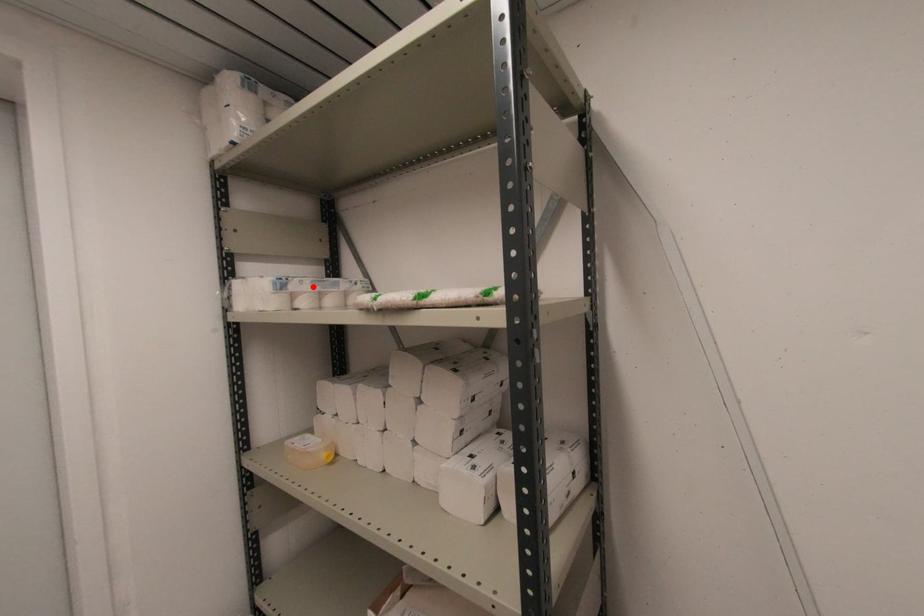
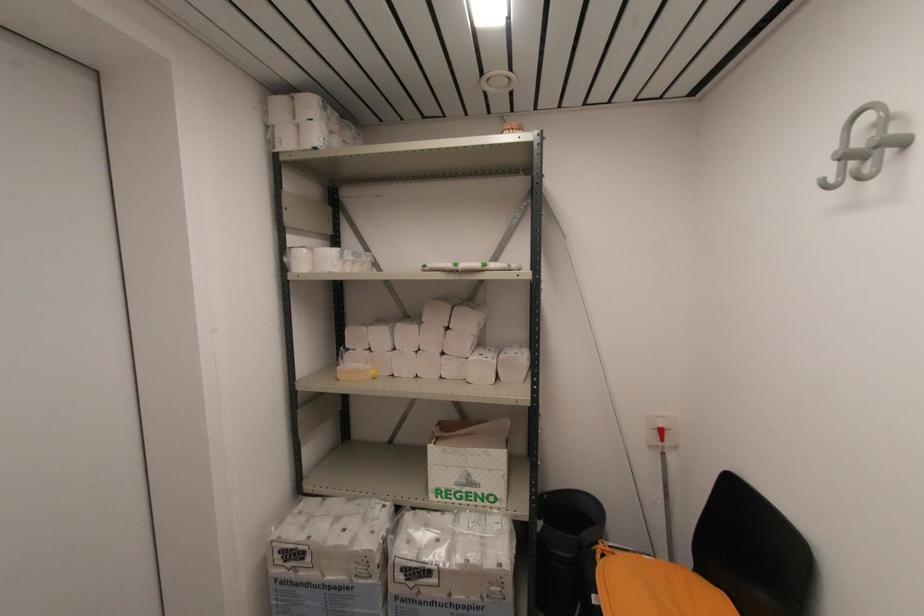
The point at the highlighted location is marked in the first image. Where is the corresponding point in the second image?

(353, 257)